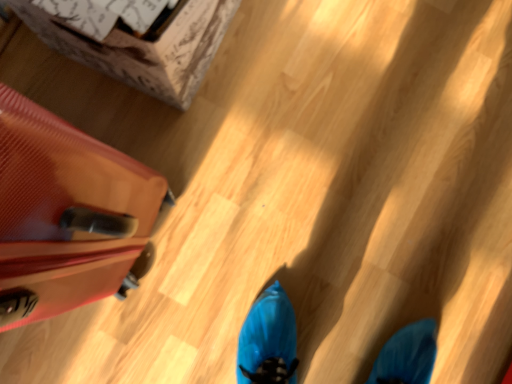
What do you see at coordinates (144, 47) in the screenshot? I see `brown cardboard box at upper left` at bounding box center [144, 47].

You are a GUI agent. You are given a task and a screenshot of the screen. Output one action in this format:
    pyautogui.click(x=<x>, y=<y>)
    Task: Click on the brown cardboard box at upper left
    
    Given the screenshot: What is the action you would take?
    pyautogui.click(x=144, y=47)

In order to face brown cardboard box at upper left, should I rotate leftwards or rightwards?

It's best to rotate left around 17.286 degrees.

Describe the element at coordinates (66, 214) in the screenshot. I see `matte red suitcase at left` at that location.

Find the location of a particular element. This screenshot has width=512, height=384. matte red suitcase at left is located at coordinates (66, 214).

I want to click on brown cardboard box at upper left, so click(x=144, y=47).

Between brown cardboard box at upper left and matte red suitcase at left, which one appears on the left side from the viewer's perspective?

matte red suitcase at left.

Who is more distant, brown cardboard box at upper left or matte red suitcase at left?

brown cardboard box at upper left is more distant.

Is point (213, 10) more distant than point (168, 201)?

No, it is not.

From the image's perspective, between brown cardboard box at upper left and matte red suitcase at left, which one is located above?

brown cardboard box at upper left.

From a real-world perspective, which object rests below the other?

From a 3D spatial view, brown cardboard box at upper left is below.

Which of these two, brown cardboard box at upper left or matte red suitcase at left, is thinner?

brown cardboard box at upper left.

Who is shorter, brown cardboard box at upper left or matte red suitcase at left?

Standing shorter between the two is brown cardboard box at upper left.

Considering the sizes of objects brown cardboard box at upper left and matte red suitcase at left in the image provided, who is smaller, brown cardboard box at upper left or matte red suitcase at left?

With smaller size is brown cardboard box at upper left.

From the picture: Is brown cardboard box at upper left surrounding matte red suitcase at left?

No, matte red suitcase at left is not a part of brown cardboard box at upper left.

Is brown cardboard box at upper left beside matte red suitcase at left?

No, brown cardboard box at upper left is not beside matte red suitcase at left.

Is matte red suitcase at left at the back of brown cardboard box at upper left?

No, brown cardboard box at upper left's orientation is not away from matte red suitcase at left.

How far apart are brown cardboard box at upper left and matte red suitcase at left?

A distance of 25.58 centimeters exists between brown cardboard box at upper left and matte red suitcase at left.

At what (x,y) coordinates should I click in order to perform the action: click on luggage lying on the left of brown cardboard box at upper left. Please return your answer as a coordinate pair (x, y). The height and width of the screenshot is (384, 512). Looking at the image, I should click on (66, 214).

Can you confirm if matte red suitcase at left is positioned to the left of brown cardboard box at upper left?

Yes, matte red suitcase at left is to the left of brown cardboard box at upper left.

Is matte red suitcase at left in front of or behind brown cardboard box at upper left in the image?

Clearly, matte red suitcase at left is in front of brown cardboard box at upper left.

Which is farther from the camera, [17,322] or [201,61]?

The point [201,61] is more distant.

From the image's perspective, is matte red suitcase at left above or below brown cardboard box at upper left?

Based on their image positions, matte red suitcase at left is located beneath brown cardboard box at upper left.

From a real-world perspective, is matte red suitcase at left physically above brown cardboard box at upper left?

Yes, from a real-world perspective, matte red suitcase at left is over brown cardboard box at upper left

Is matte red suitcase at left thinner than brown cardboard box at upper left?

Incorrect, the width of matte red suitcase at left is not less than that of brown cardboard box at upper left.

From the picture: Is matte red suitcase at left taller than brown cardboard box at upper left?

Yes, matte red suitcase at left is taller than brown cardboard box at upper left.

Is matte red suitcase at left smaller than brown cardboard box at upper left?

No.

Is matte red suitcase at left inside the boundaries of brown cardboard box at upper left, or outside?

matte red suitcase at left is outside brown cardboard box at upper left.

Is matte red suitcase at left in contact with brown cardboard box at upper left?

No.

Is matte red suitcase at left looking in the opposite direction of brown cardboard box at upper left?

matte red suitcase at left is not turned away from brown cardboard box at upper left.

Based on the photo, what's the angular difference between matte red suitcase at left and brown cardboard box at upper left's facing directions?

A: matte red suitcase at left and brown cardboard box at upper left are facing 0.000143 degrees away from each other.

Measure the distance between matte red suitcase at left and brown cardboard box at upper left.

matte red suitcase at left and brown cardboard box at upper left are 10.07 inches apart.

Where is `cardboard box behind the matte red suitcase at left`? This screenshot has width=512, height=384. cardboard box behind the matte red suitcase at left is located at coordinates (144, 47).

Locate an element on the screen. Image resolution: width=512 pixels, height=384 pixels. cardboard box lying on the right of matte red suitcase at left is located at coordinates (144, 47).

In order to click on luggage above the brown cardboard box at upper left (from a real-world perspective) in this screenshot , I will do `click(66, 214)`.